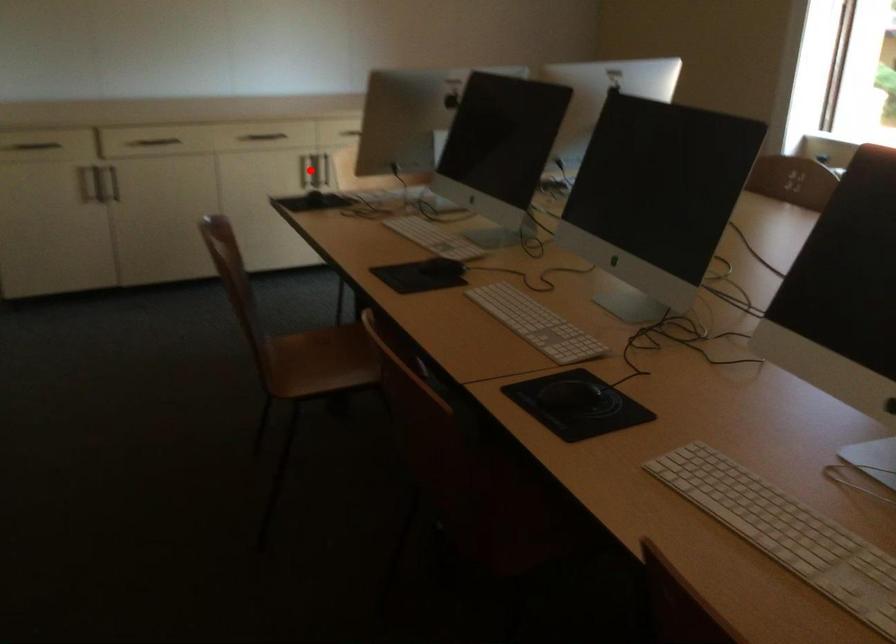
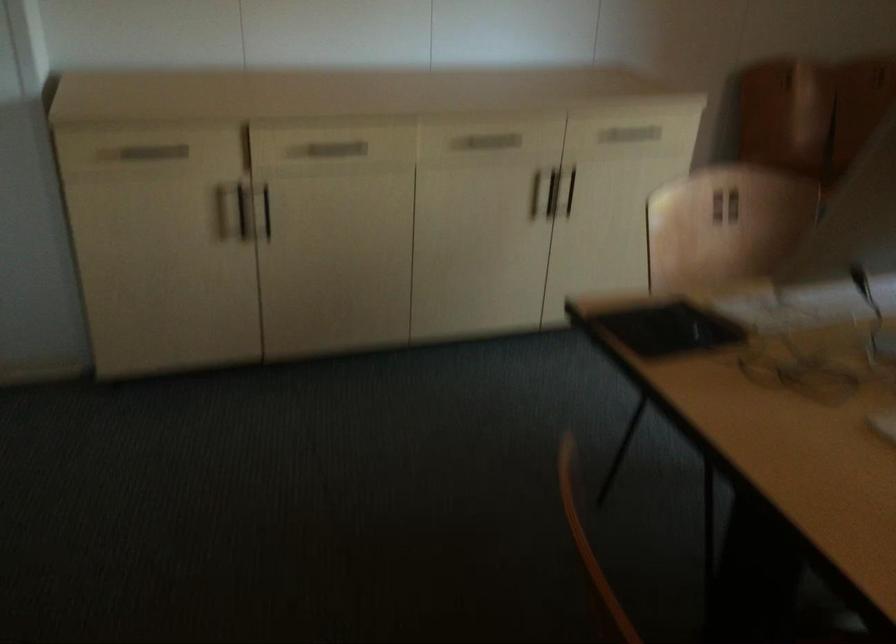
Question: I am providing you with two images of the same scene from different viewpoints. A red point is shown in image1. For the corresponding object point in image2, is it positioned nearer or farther from the camera?

Choices:
 (A) Nearer
 (B) Farther

Answer: (A)